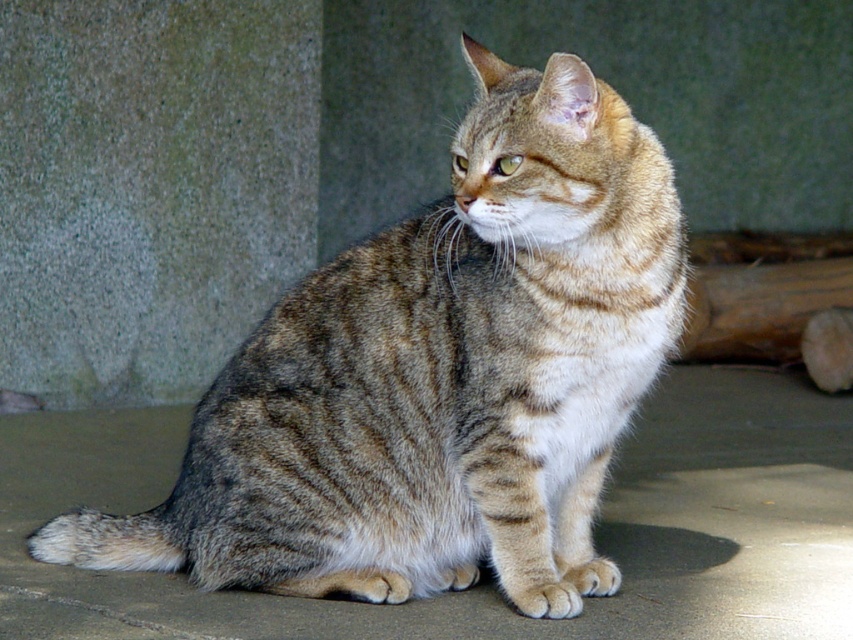
You are standing in front of the scene and want to place a small plant pot between the tabby cat and the gray textured wall at left. Based on their positions, can you determine if there is enough space between them to fit the plant pot?

The gray textured wall at left is located at point (149, 188), but without specific distance information between the tabby cat and the wall, it is impossible to determine if there is enough space for the plant pot.

You are standing in front of a concrete wall with a tabby cat. The cat is located at point [439,376]. If you want to place a small bowl of water exactly 0.3 units to the right of the cat, where would the bowl be positioned?

The bowl would be positioned at point 0.889, 0.516, which is 0.3 units to the right of the tabby fur cat at center located at [439,376].